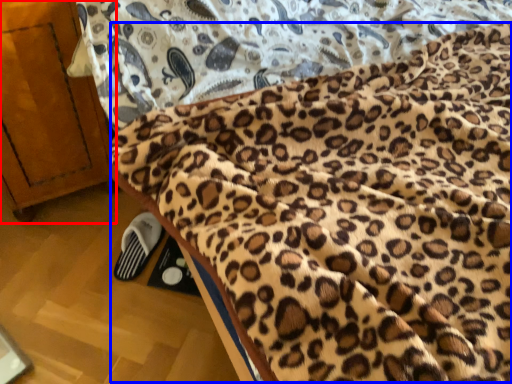
Question: Which object appears closest to the camera in this image, furniture (highlighted by a red box) or blanket (highlighted by a blue box)?

Choices:
 (A) furniture
 (B) blanket

Answer: (B)